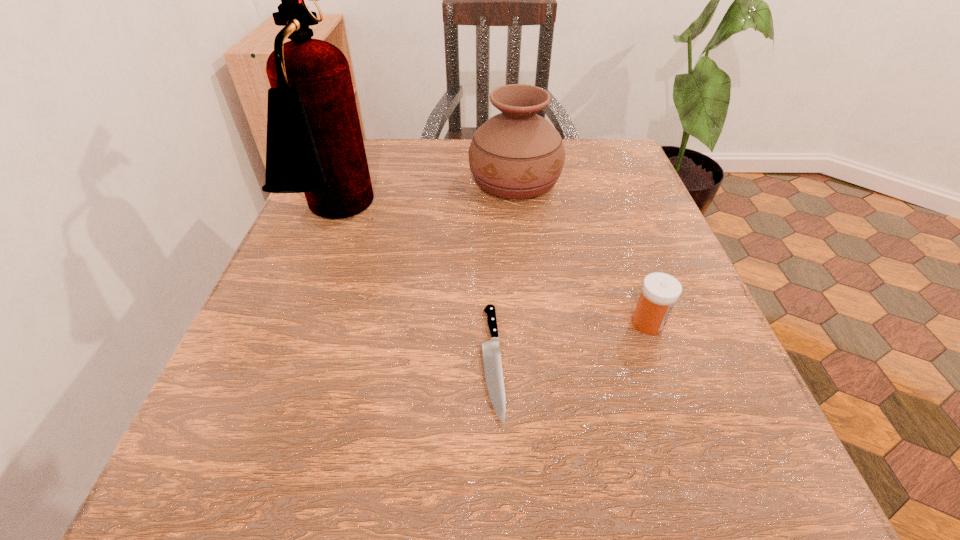
In the image, there is a desktop. Where is `blank space at the near left corner`? This screenshot has height=540, width=960. blank space at the near left corner is located at coordinates (169, 481).

Locate an element on the screen. The image size is (960, 540). vacant space that is in between the leftmost object and the steak knife is located at coordinates (415, 288).

This screenshot has height=540, width=960. I want to click on vacant space that's between the steak knife and the urn, so click(x=504, y=271).

Find the location of a particular element. This screenshot has height=540, width=960. vacant space that is in between the shortest object and the urn is located at coordinates (504, 271).

Locate an element on the screen. The image size is (960, 540). vacant area between the fire extinguisher and the shortest object is located at coordinates (415, 288).

The image size is (960, 540). Find the location of `free spot between the third tallest object and the tallest object`. free spot between the third tallest object and the tallest object is located at coordinates (492, 269).

Locate an element on the screen. The width and height of the screenshot is (960, 540). free space between the fire extinguisher and the urn is located at coordinates click(x=425, y=198).

Locate an element on the screen. vacant space that is in between the urn and the rightmost object is located at coordinates (582, 252).

Image resolution: width=960 pixels, height=540 pixels. Identify the location of vacant space that is in between the steak knife and the tallest object. (415, 288).

The image size is (960, 540). What are the coordinates of `vacant space in between the rightmost object and the shortest object` in the screenshot? It's located at (570, 342).